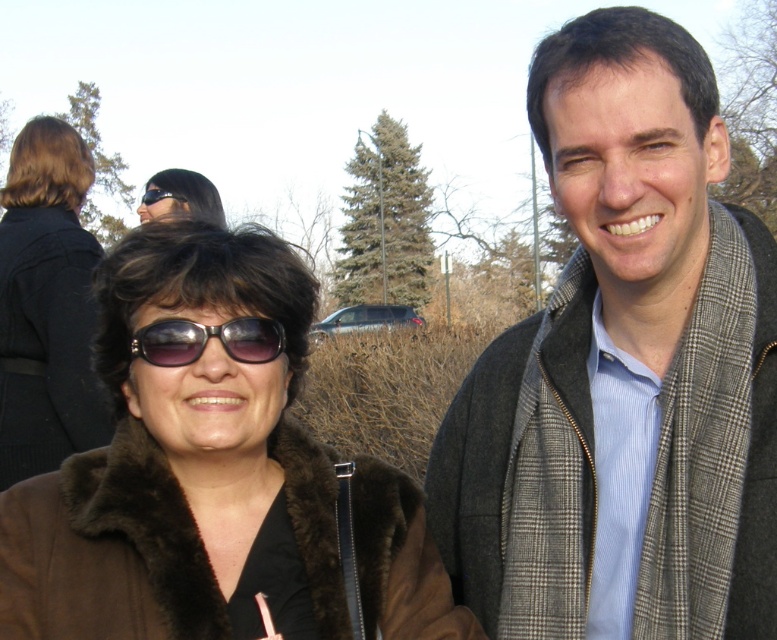
Question: Which point appears closest to the camera in this image?

Choices:
 (A) pos(138,352)
 (B) pos(40,164)

Answer: (A)

Question: Based on their relative distances, which object is nearer to the black fuzzy coat at left?

Choices:
 (A) brown fur coat at left
 (B) sunglasses at center
 (C) plaid scarf at center

Answer: (A)

Question: Does plaid scarf at center have a lesser width compared to black fuzzy coat at left?

Choices:
 (A) yes
 (B) no

Answer: (A)

Question: Can you confirm if plaid scarf at center is positioned above black fuzzy coat at left?

Choices:
 (A) no
 (B) yes

Answer: (A)

Question: Can you confirm if plaid scarf at center is thinner than brown fur coat at left?

Choices:
 (A) no
 (B) yes

Answer: (B)

Question: Based on their relative distances, which object is nearer to the plaid scarf at center?

Choices:
 (A) brown fur coat at left
 (B) sunglasses at center
 (C) black fuzzy coat at left

Answer: (A)